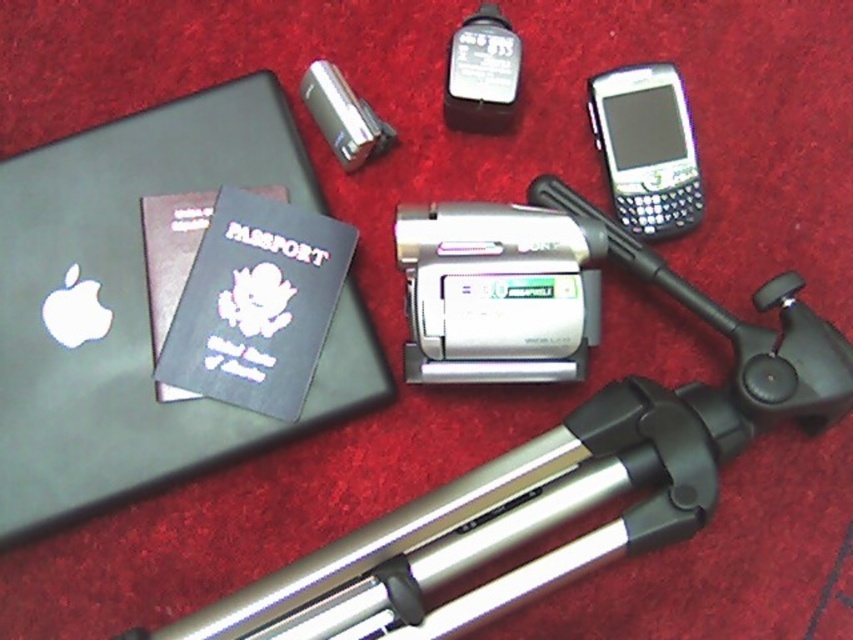
You are standing in front of the travel items arranged on the red carpet. There are two points marked in the image. Point A is at coordinates point (x=4, y=196) and Point B is at coordinates point (x=799, y=348). Which point is closer to you?

Point A at coordinates point (x=4, y=196) is closer to you because it is further to the viewer than point (x=799, y=348).

You are packing for a trip and need to place your matte black laptop at upper left and silver metallic tripod at lower center into a bag. Based on their positions in the image, which item is closer to the top of the bag when you start packing?

The matte black laptop at upper left is located above the silver metallic tripod at lower center in the image, so when packing, the matte black laptop at upper left would naturally be placed closer to the top of the bag.

What are the coordinates of the matte black laptop at upper left?

The coordinates of the matte black laptop at upper left are at point (138, 304).